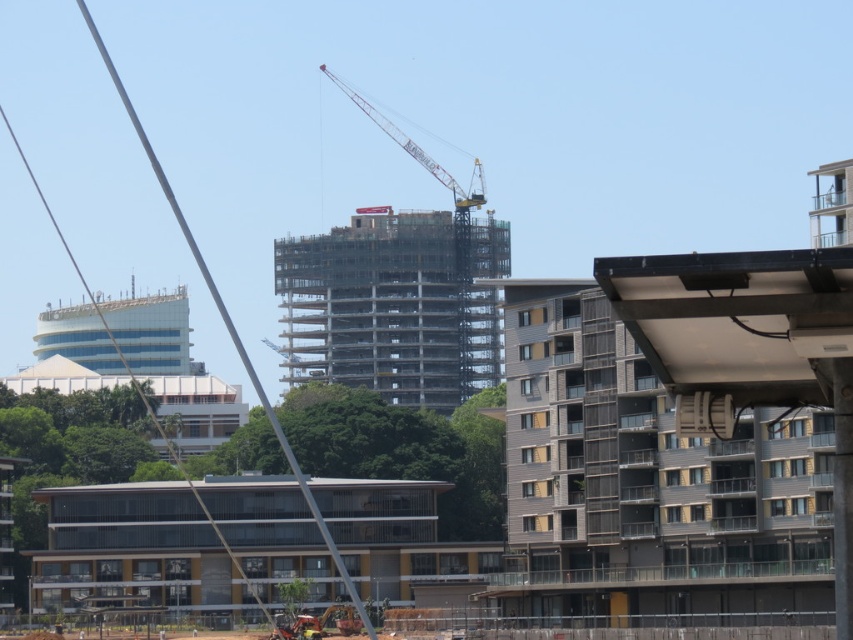
Question: Which point appears farthest from the camera in this image?

Choices:
 (A) (469, 314)
 (B) (341, 88)

Answer: (B)

Question: Which object appears farthest from the camera in this image?

Choices:
 (A) metal scaffolding at center
 (B) metallic yellow crane at upper center

Answer: (B)

Question: Can you confirm if metal scaffolding at center is thinner than metallic yellow crane at upper center?

Choices:
 (A) no
 (B) yes

Answer: (A)

Question: Can you confirm if metal scaffolding at center is smaller than metallic yellow crane at upper center?

Choices:
 (A) no
 (B) yes

Answer: (A)

Question: Is metal scaffolding at center above metallic yellow crane at upper center?

Choices:
 (A) no
 (B) yes

Answer: (A)

Question: Which point is farther from the camera taking this photo?

Choices:
 (A) tap(341, 88)
 (B) tap(289, 326)

Answer: (A)